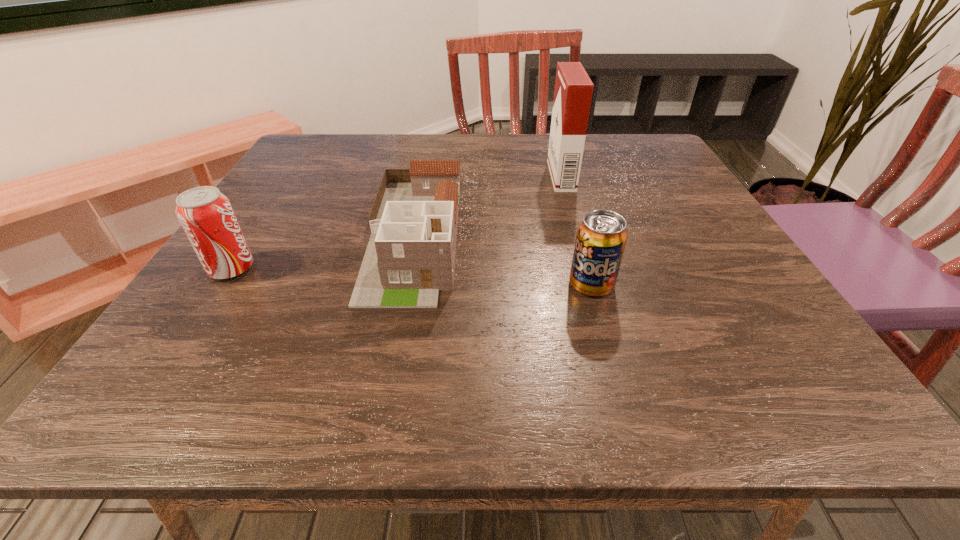
Locate an element on the screen. This screenshot has width=960, height=540. free space in the image that satisfies the following two spatial constraints: 1. on the back side of the shorter soda can; 2. on the logo side of the left soda can is located at coordinates (587, 269).

I want to click on vacant space that satisfies the following two spatial constraints: 1. on the back side of the right soda can; 2. on the logo side of the left soda can, so click(587, 269).

I want to click on vacant space that satisfies the following two spatial constraints: 1. on the front-facing side of the cigarette_case; 2. at the main entrance of the second object from left to right, so click(578, 235).

Identify the location of free location that satisfies the following two spatial constraints: 1. at the main entrance of the third object from right to left; 2. on the left side of the right soda can. (405, 285).

The height and width of the screenshot is (540, 960). In order to click on vacant region that satisfies the following two spatial constraints: 1. on the back side of the shorter soda can; 2. on the logo side of the left soda can in this screenshot , I will do `click(587, 269)`.

The image size is (960, 540). I want to click on vacant region that satisfies the following two spatial constraints: 1. on the logo side of the left soda can; 2. on the back side of the shorter soda can, so click(x=222, y=285).